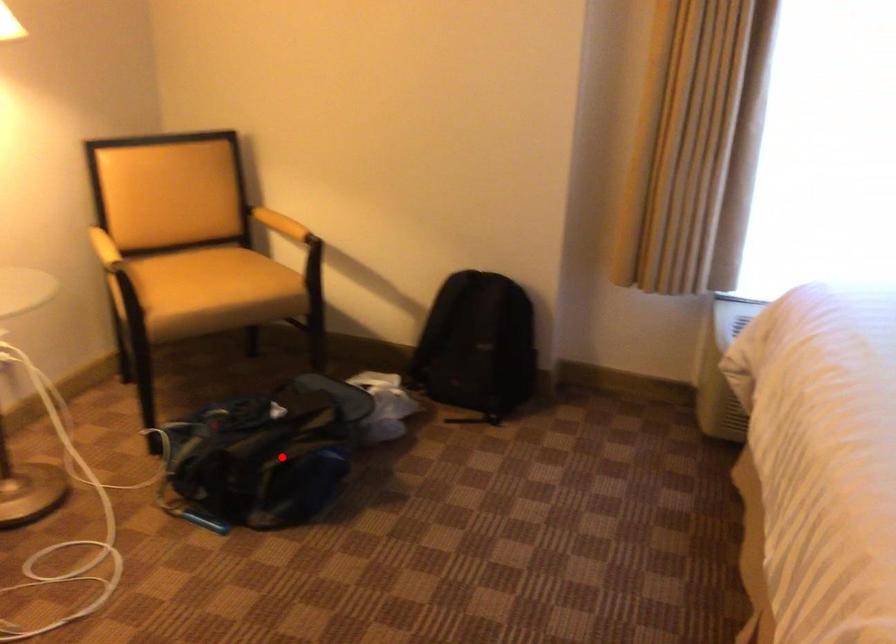
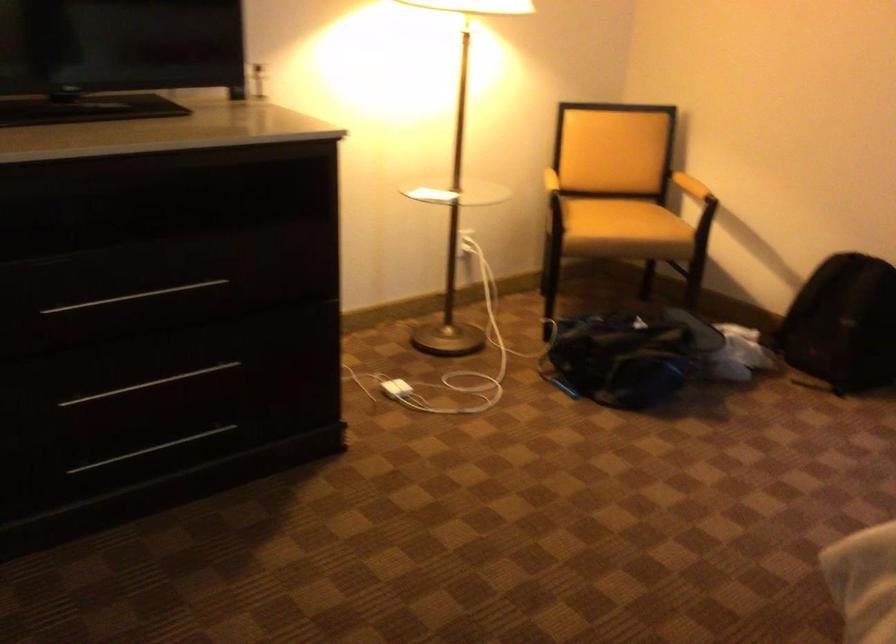
Question: I am providing you with two images of the same scene from different viewpoints. A red point is shown in image1. For the corresponding object point in image2, is it positioned nearer or farther from the camera?

Choices:
 (A) Nearer
 (B) Farther

Answer: (B)